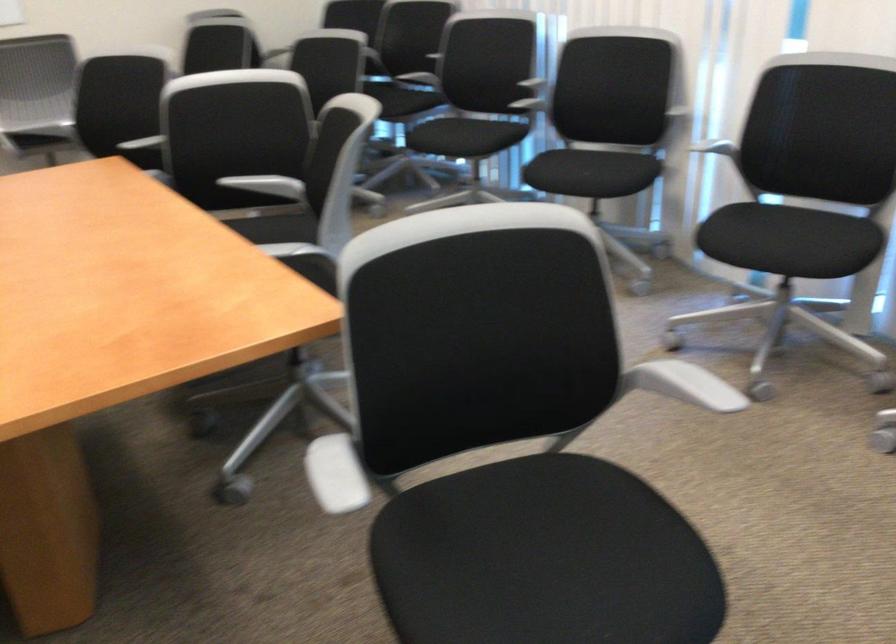
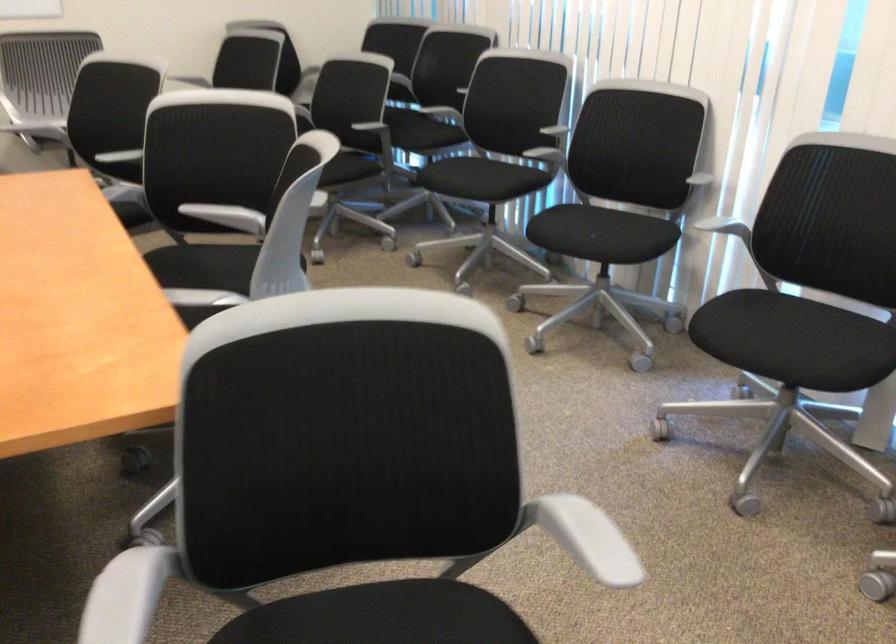
In the second image, find the point that corresponds to point (791, 237) in the first image.

(795, 342)